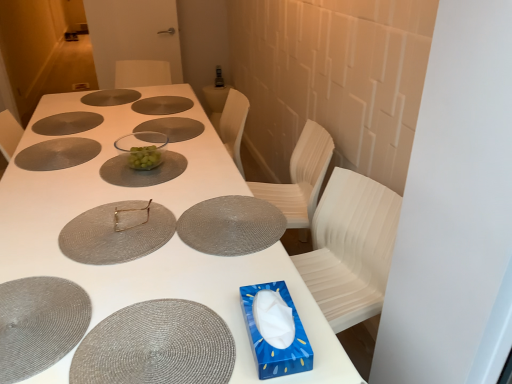
Find the location of a particular element. vacant area that lies between matte gray placemat at lower center, the ninth glass plate from the back, and matte gray placemat at center, the 8th glass plate positioned from the back is located at coordinates (153, 268).